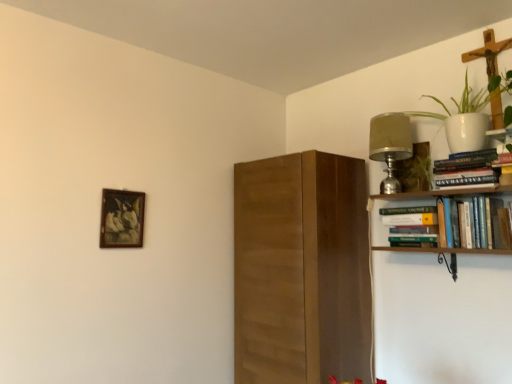
Measure the distance between hardcover books at upper right, which is counted as the 3th book, starting from the bottom, and camera.

hardcover books at upper right, which is counted as the 3th book, starting from the bottom, and camera are 1.58 meters apart from each other.

The image size is (512, 384). Describe the element at coordinates (445, 239) in the screenshot. I see `hardcover books at upper right, which is the 3th book from top to bottom` at that location.

Describe the element at coordinates (467, 114) in the screenshot. I see `white ceramic pot at upper right` at that location.

Measure the distance between point (x=393, y=208) and camera.

They are 1.99 meters apart.

The width and height of the screenshot is (512, 384). In order to click on matte silver lamp at upper right in this screenshot , I will do `click(390, 145)`.

Find the location of a particular element. hardcover books at upper right, arranged as the 1th book when viewed from the top is located at coordinates (466, 170).

In terms of height, does hardcover book at upper right, the second book positioned from the bottom, look taller or shorter compared to matte silver lamp at upper right?

hardcover book at upper right, the second book positioned from the bottom, is shorter than matte silver lamp at upper right.

Considering the relative sizes of hardcover book at upper right, which is counted as the second book, starting from the top, and matte silver lamp at upper right in the image provided, is hardcover book at upper right, which is counted as the second book, starting from the top, bigger than matte silver lamp at upper right?

No, hardcover book at upper right, which is counted as the second book, starting from the top, is not bigger than matte silver lamp at upper right.

Is hardcover book at upper right, which is counted as the second book, starting from the top, far away from matte silver lamp at upper right?

They are positioned close to each other.

Considering the relative sizes of hardcover books at upper right, arranged as the 1th book when viewed from the top, and hardcover book at upper right, the second book positioned from the bottom, in the image provided, is hardcover books at upper right, arranged as the 1th book when viewed from the top, smaller than hardcover book at upper right, the second book positioned from the bottom,?

Yes.

Does hardcover books at upper right, arranged as the 1th book when viewed from the top, have a greater width compared to hardcover book at upper right, which is counted as the second book, starting from the top?

Incorrect, the width of hardcover books at upper right, arranged as the 1th book when viewed from the top, does not surpass that of hardcover book at upper right, which is counted as the second book, starting from the top.

Image resolution: width=512 pixels, height=384 pixels. I want to click on book above the hardcover book at upper right, which is counted as the second book, starting from the top (from a real-world perspective), so click(466, 170).

Is hardcover books at upper right, which is the 3th book from top to bottom, touching matte silver lamp at upper right?

hardcover books at upper right, which is the 3th book from top to bottom, and matte silver lamp at upper right are clearly separated.

In terms of width, does hardcover books at upper right, which is the 3th book from top to bottom, look wider or thinner when compared to matte silver lamp at upper right?

Considering their sizes, hardcover books at upper right, which is the 3th book from top to bottom, looks slimmer than matte silver lamp at upper right.

Is hardcover books at upper right, which is the 3th book from top to bottom, positioned with its back to matte silver lamp at upper right?

No, matte silver lamp at upper right is not at the back of hardcover books at upper right, which is the 3th book from top to bottom.

How many degrees apart are the facing directions of hardcover books at upper right, marked as the first book in a bottom-to-top arrangement, and matte silver lamp at upper right?

There is a 0.524-degree angle between the facing directions of hardcover books at upper right, marked as the first book in a bottom-to-top arrangement, and matte silver lamp at upper right.

Which object is closer to the camera taking this photo, wooden picture frame at upper left or hardcover book at upper right, the second book positioned from the bottom?

hardcover book at upper right, the second book positioned from the bottom.

I want to click on picture frame that is behind the hardcover book at upper right, the second book positioned from the bottom, so click(122, 219).

From the image's perspective, between wooden picture frame at upper left and hardcover book at upper right, the second book positioned from the bottom, which one is located above?

wooden picture frame at upper left, from the image's perspective.

Does wooden picture frame at upper left have a greater width compared to hardcover book at upper right, the second book positioned from the bottom?

No.

Can we say matte silver lamp at upper right lies outside white ceramic pot at upper right?

Yes, matte silver lamp at upper right is not within white ceramic pot at upper right.

Can you confirm if matte silver lamp at upper right is shorter than white ceramic pot at upper right?

Incorrect, the height of matte silver lamp at upper right does not fall short of that of white ceramic pot at upper right.

Is matte silver lamp at upper right facing away from white ceramic pot at upper right?

No.

Is hardcover books at upper right, marked as the first book in a bottom-to-top arrangement, wider than hardcover book at upper right, which is counted as the second book, starting from the top?

Incorrect, the width of hardcover books at upper right, marked as the first book in a bottom-to-top arrangement, does not surpass that of hardcover book at upper right, which is counted as the second book, starting from the top.

Are hardcover books at upper right, marked as the first book in a bottom-to-top arrangement, and hardcover book at upper right, the second book positioned from the bottom, beside each other?

Yes, hardcover books at upper right, marked as the first book in a bottom-to-top arrangement, and hardcover book at upper right, the second book positioned from the bottom, clearly make contact.

Starting from the hardcover books at upper right, which is the 3th book from top to bottom, which book is the 2nd one behind? Please provide its 2D coordinates.

[(411, 226)]

Measure the distance from matte silver lamp at upper right to hardcover book at upper right, the second book positioned from the bottom.

matte silver lamp at upper right is 10.38 inches from hardcover book at upper right, the second book positioned from the bottom.

From the image's perspective, is matte silver lamp at upper right above hardcover book at upper right, which is counted as the second book, starting from the top?

Yes, from the image's perspective, matte silver lamp at upper right is on top of hardcover book at upper right, which is counted as the second book, starting from the top.

Is matte silver lamp at upper right positioned with its back to hardcover book at upper right, the second book positioned from the bottom?

matte silver lamp at upper right does not have its back to hardcover book at upper right, the second book positioned from the bottom.

Between matte silver lamp at upper right and hardcover book at upper right, which is counted as the second book, starting from the top, which one has larger size?

With larger size is matte silver lamp at upper right.

I want to click on the 2nd book below the matte silver lamp at upper right (from the image's perspective), so click(411, 226).

The width and height of the screenshot is (512, 384). In order to click on the 1st book in front of the hardcover book at upper right, which is counted as the second book, starting from the top in this screenshot , I will do `click(466, 170)`.

When comparing their distances from white ceramic pot at upper right, does hardcover books at upper right, arranged as the 1th book when viewed from the top, or matte silver lamp at upper right seem closer?

Among the two, hardcover books at upper right, arranged as the 1th book when viewed from the top, is located nearer to white ceramic pot at upper right.

Considering their positions, is hardcover book at upper right, the second book positioned from the bottom, positioned closer to hardcover books at upper right, marked as the first book in a bottom-to-top arrangement, than matte silver lamp at upper right?

hardcover book at upper right, the second book positioned from the bottom, is positioned closer to the anchor hardcover books at upper right, marked as the first book in a bottom-to-top arrangement.

Looking at the image, which one is located closer to matte silver lamp at upper right, hardcover books at upper right, which is counted as the 3th book, starting from the bottom, or wooden picture frame at upper left?

Among the two, hardcover books at upper right, which is counted as the 3th book, starting from the bottom, is located nearer to matte silver lamp at upper right.

Estimate the real-world distances between objects in this image. Which object is closer to hardcover books at upper right, which is the 3th book from top to bottom, matte silver lamp at upper right or white ceramic pot at upper right?

Based on the image, matte silver lamp at upper right appears to be nearer to hardcover books at upper right, which is the 3th book from top to bottom.

Looking at this image, looking at the image, which one is located closer to matte silver lamp at upper right, hardcover books at upper right, which is the 3th book from top to bottom, or white ceramic pot at upper right?

hardcover books at upper right, which is the 3th book from top to bottom, is positioned closer to the anchor matte silver lamp at upper right.

Looking at the image, which one is located further to matte silver lamp at upper right, hardcover book at upper right, which is counted as the second book, starting from the top, or white ceramic pot at upper right?

Among the two, hardcover book at upper right, which is counted as the second book, starting from the top, is located further to matte silver lamp at upper right.

Considering their positions, is wooden picture frame at upper left positioned further to hardcover books at upper right, which is counted as the 3th book, starting from the bottom, than hardcover books at upper right, which is the 3th book from top to bottom?

wooden picture frame at upper left is positioned further to the anchor hardcover books at upper right, which is counted as the 3th book, starting from the bottom.

Based on their spatial positions, is hardcover books at upper right, which is the 3th book from top to bottom, or hardcover books at upper right, which is counted as the 3th book, starting from the bottom, further from wooden picture frame at upper left?

hardcover books at upper right, which is counted as the 3th book, starting from the bottom, is positioned further to the anchor wooden picture frame at upper left.

This screenshot has height=384, width=512. Find the location of `lamp between wooden picture frame at upper left and white ceramic pot at upper right in the horizontal direction`. lamp between wooden picture frame at upper left and white ceramic pot at upper right in the horizontal direction is located at coordinates (390, 145).

Find the location of a particular element. Image resolution: width=512 pixels, height=384 pixels. book between hardcover books at upper right, which is counted as the 3th book, starting from the bottom, and hardcover books at upper right, which is the 3th book from top to bottom, vertically is located at coordinates (411, 226).

Image resolution: width=512 pixels, height=384 pixels. In order to click on lamp situated between wooden picture frame at upper left and hardcover books at upper right, which is the 3th book from top to bottom, from left to right in this screenshot , I will do `click(390, 145)`.

Where is `book located between wooden picture frame at upper left and hardcover books at upper right, marked as the first book in a bottom-to-top arrangement, in the left-right direction`? book located between wooden picture frame at upper left and hardcover books at upper right, marked as the first book in a bottom-to-top arrangement, in the left-right direction is located at coordinates 411,226.